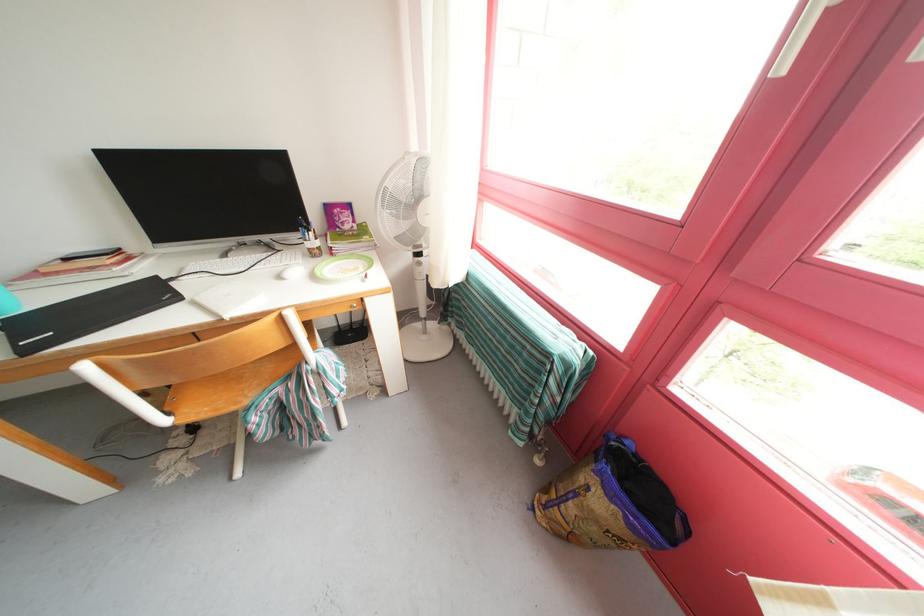
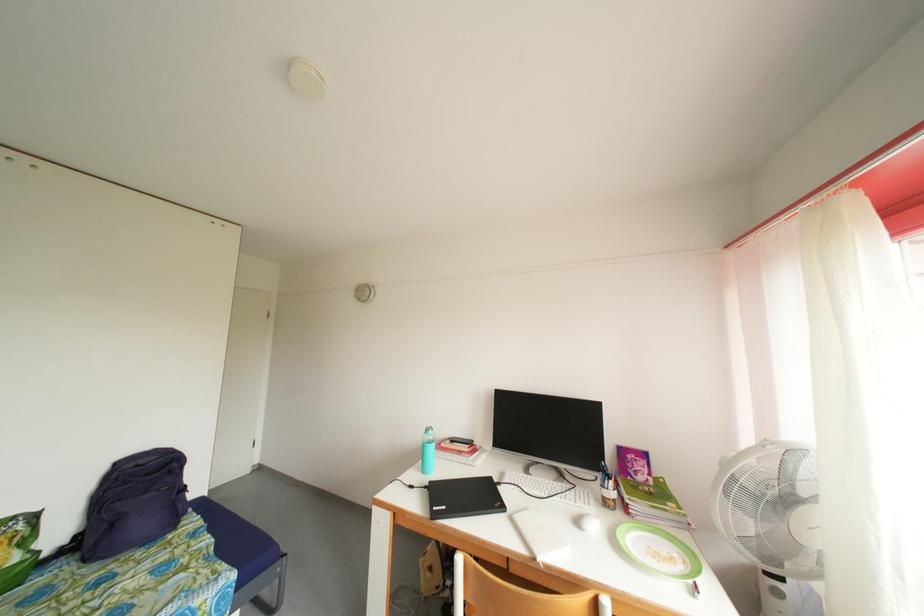
Locate, in the second image, the point that corresponds to [369,276] in the first image.

(688, 573)